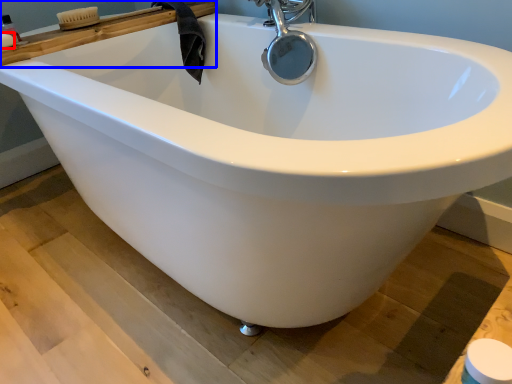
Question: Among these objects, which one is nearest to the camera, soap (highlighted by a red box) or ledge (highlighted by a blue box)?

Choices:
 (A) soap
 (B) ledge

Answer: (A)